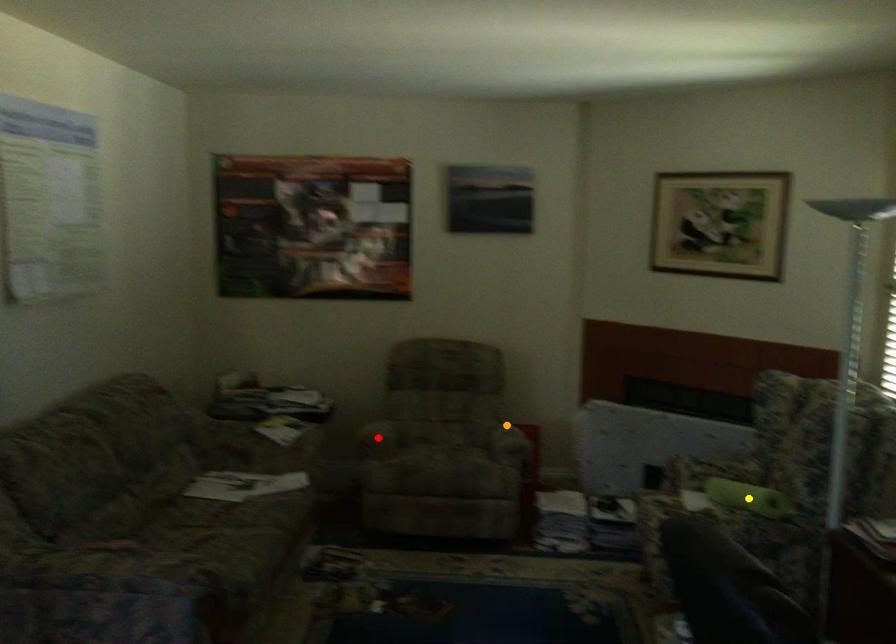
Order these from nearest to farthest:
A) yellow point
B) red point
C) orange point

yellow point
red point
orange point